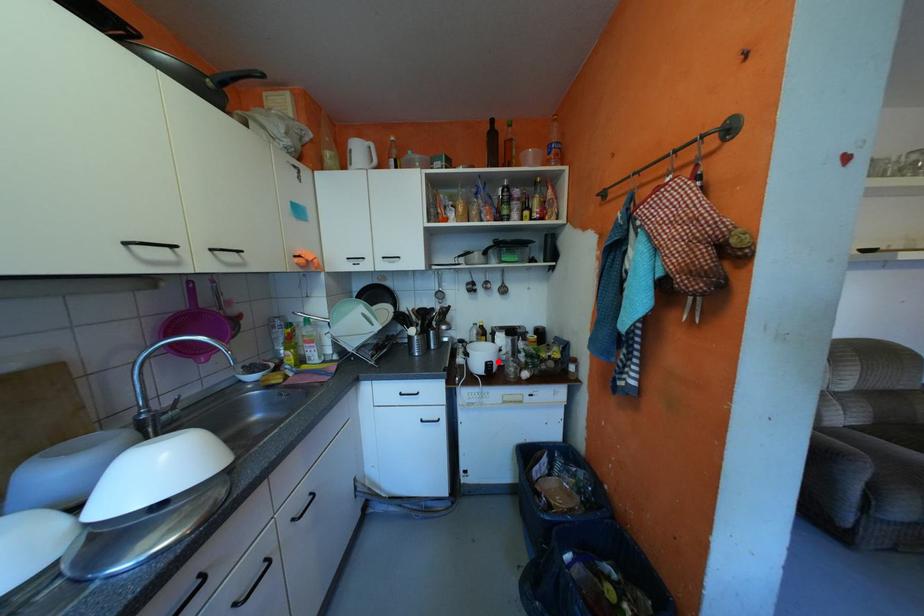
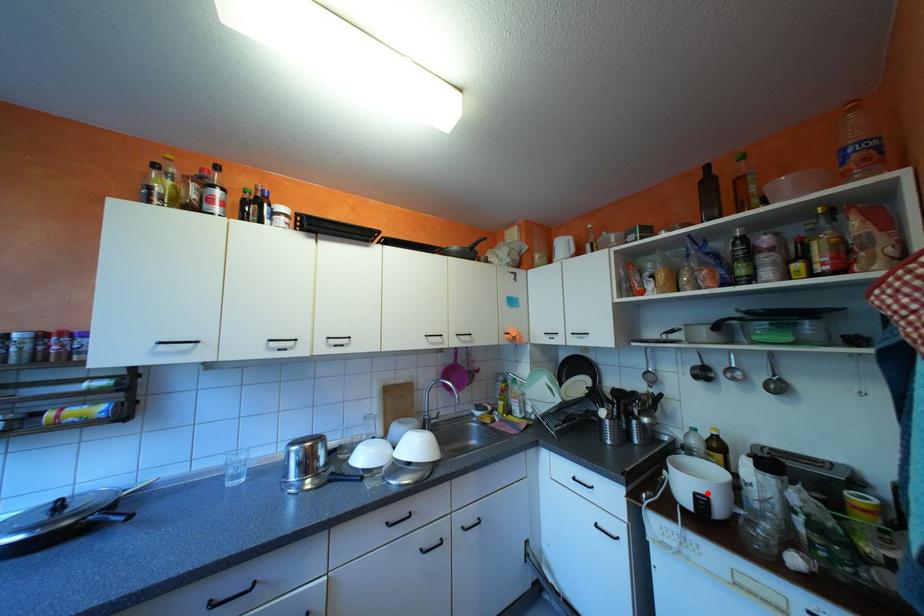
I am providing you with two images of the same scene from different viewpoints. A red point is marked on the first image and another point is marked on the second image. Is the marked point in image1 the same physical position as the marked point in image2?

Yes